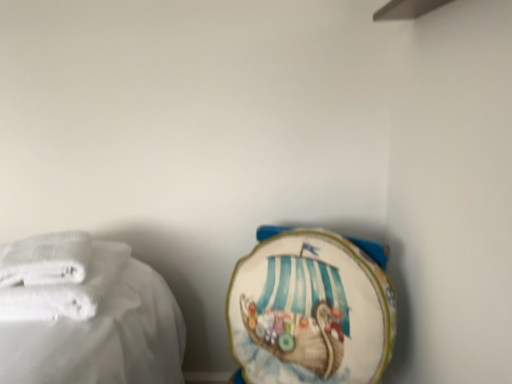
Question: From a real-world perspective, is white fabric towel at lower right, which is counted as the 3th towel, starting from the left, beneath white soft towel at left, positioned as the second towel in left-to-right order?

Choices:
 (A) yes
 (B) no

Answer: (A)

Question: Does white fabric towel at lower right, which is the 1th towel in right-to-left order, come behind white soft towel at left, the 2th towel when ordered from right to left?

Choices:
 (A) no
 (B) yes

Answer: (A)

Question: Does white fabric towel at lower right, which is counted as the 3th towel, starting from the left, appear on the left side of white soft towel at left, the 2th towel when ordered from right to left?

Choices:
 (A) no
 (B) yes

Answer: (A)

Question: Is white fabric towel at lower right, which is counted as the 3th towel, starting from the left, smaller than white soft towel at left, positioned as the second towel in left-to-right order?

Choices:
 (A) no
 (B) yes

Answer: (A)

Question: Is white fabric towel at lower right, which is the 1th towel in right-to-left order, wider than white soft towel at left, positioned as the second towel in left-to-right order?

Choices:
 (A) no
 (B) yes

Answer: (B)

Question: Is the depth of white fabric towel at lower right, which is the 1th towel in right-to-left order, less than that of white soft towel at left, the 2th towel when ordered from right to left?

Choices:
 (A) no
 (B) yes

Answer: (B)

Question: Is white soft towel at left, positioned as the second towel in left-to-right order, outside of white fabric towel at lower right, which is counted as the 3th towel, starting from the left?

Choices:
 (A) yes
 (B) no

Answer: (A)

Question: From the image's perspective, does white soft towel at left, the 2th towel when ordered from right to left, appear lower than white fabric towel at lower right, which is counted as the 3th towel, starting from the left?

Choices:
 (A) no
 (B) yes

Answer: (A)

Question: Is white fabric towel at lower right, which is counted as the 3th towel, starting from the left, surrounded by white soft towel at left, positioned as the second towel in left-to-right order?

Choices:
 (A) no
 (B) yes

Answer: (A)

Question: Are white soft towel at left, the 2th towel when ordered from right to left, and white fabric towel at lower right, which is counted as the 3th towel, starting from the left, located far from each other?

Choices:
 (A) yes
 (B) no

Answer: (B)

Question: Is the depth of white soft towel at left, positioned as the second towel in left-to-right order, greater than that of white fabric towel at lower right, which is the 1th towel in right-to-left order?

Choices:
 (A) no
 (B) yes

Answer: (B)

Question: Can you confirm if white soft towel at left, the 2th towel when ordered from right to left, is shorter than white fabric towel at lower right, which is the 1th towel in right-to-left order?

Choices:
 (A) no
 (B) yes

Answer: (B)

Question: Considering the relative sizes of white fabric towel at lower right, which is counted as the 3th towel, starting from the left, and white soft towel at left, placed as the 3th towel when sorted from right to left, in the image provided, is white fabric towel at lower right, which is counted as the 3th towel, starting from the left, smaller than white soft towel at left, placed as the 3th towel when sorted from right to left,?

Choices:
 (A) no
 (B) yes

Answer: (A)